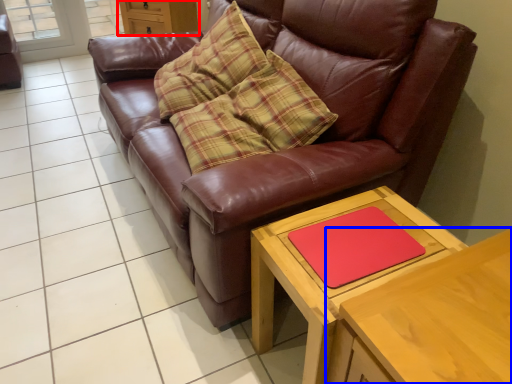
Question: Which object is further to the camera taking this photo, dresser (highlighted by a red box) or table (highlighted by a blue box)?

Choices:
 (A) dresser
 (B) table

Answer: (A)